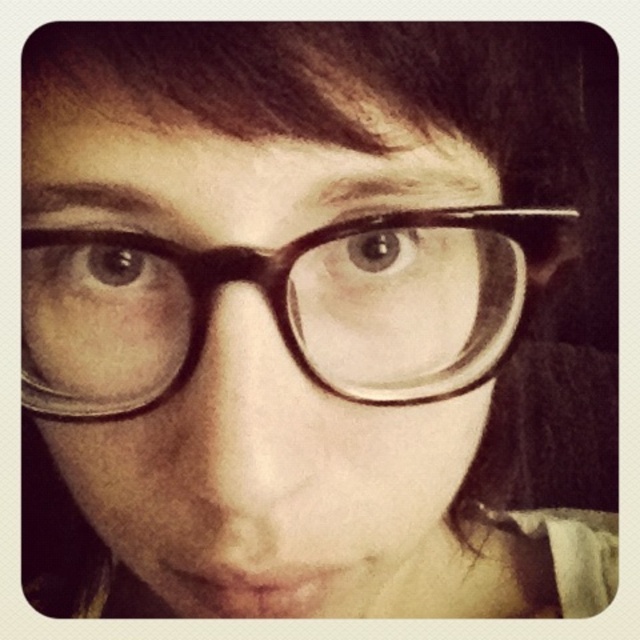
Does matte black glasses at center have a lesser height compared to black plastic glasses at center?

In fact, matte black glasses at center may be taller than black plastic glasses at center.

At what (x,y) coordinates should I click in order to perform the action: click on matte black glasses at center. Please return your answer as a coordinate pair (x, y). This screenshot has height=640, width=640. Looking at the image, I should click on (230, 353).

Find the location of a particular element. matte black glasses at center is located at coordinates (230, 353).

Identify the location of matte black glasses at center. This screenshot has height=640, width=640. point(230,353).